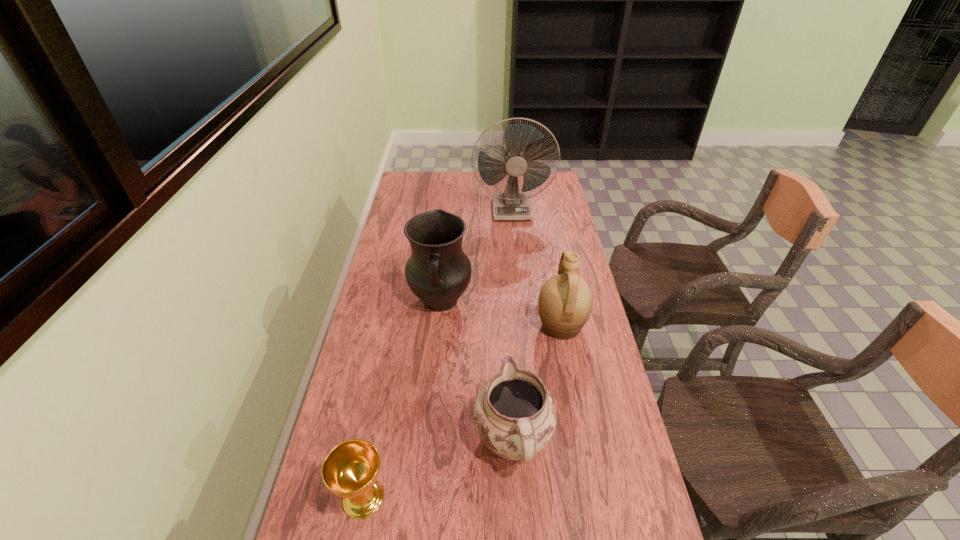
Where is `the farthest object`? The height and width of the screenshot is (540, 960). the farthest object is located at coordinates (511, 204).

Find the location of a particular element. The image size is (960, 540). the tallest object is located at coordinates (511, 204).

You are a GUI agent. You are given a task and a screenshot of the screen. Output one action in this format:
    pyautogui.click(x=<x>, y=<y>)
    Task: Click on the leftmost pitcher
    The width and height of the screenshot is (960, 540).
    Given the screenshot: What is the action you would take?
    pyautogui.click(x=438, y=272)

Locate an element on the screen. the fourth tallest object is located at coordinates (514, 414).

You are a GUI agent. You are given a task and a screenshot of the screen. Output one action in this format:
    pyautogui.click(x=<x>, y=<y>)
    Task: Click on the nearest pitcher
    
    Given the screenshot: What is the action you would take?
    pyautogui.click(x=514, y=414)

Identify the location of the shortest object. The width and height of the screenshot is (960, 540). (350, 470).

Identify the location of free space located 0.260m on the front-facing side of the farthest object. (517, 262).

At what (x,y) coordinates should I click in order to perform the action: click on free space located on the handle side of the leftmost pitcher. Please return your answer as a coordinate pair (x, y). Looking at the image, I should click on (430, 409).

The height and width of the screenshot is (540, 960). I want to click on free space located 0.290m on the spout of the shortest pitcher, so click(x=506, y=321).

The height and width of the screenshot is (540, 960). I want to click on free space located 0.110m on the spout of the shortest pitcher, so click(509, 366).